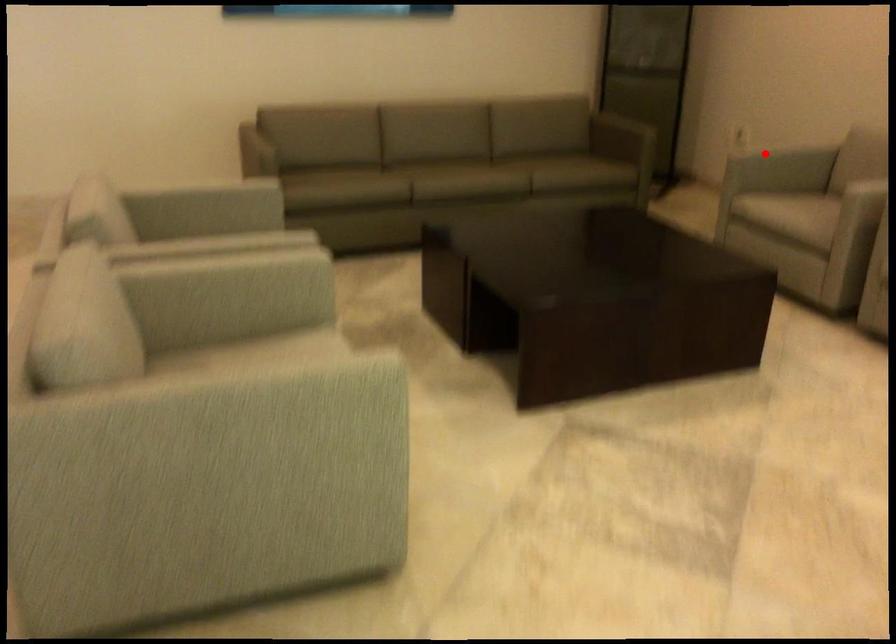
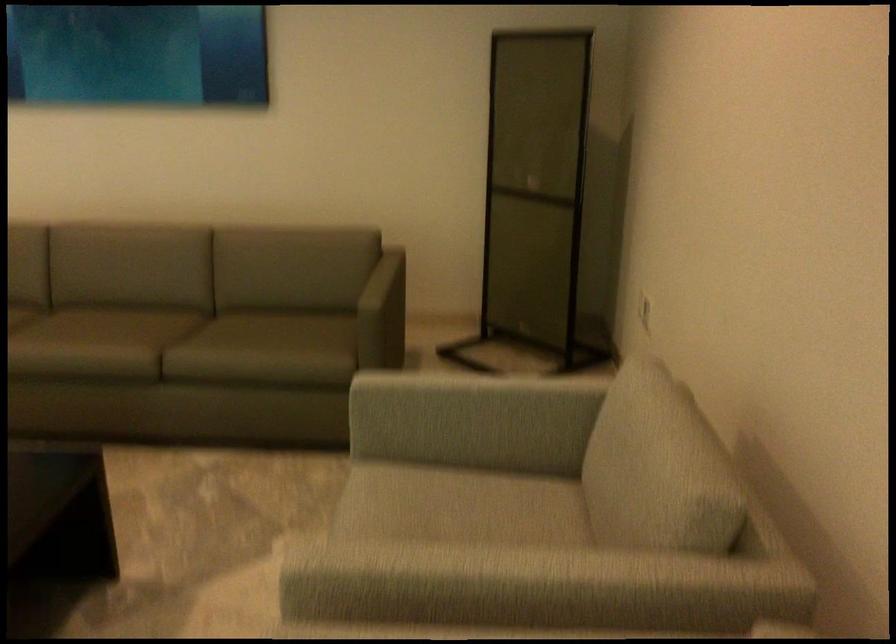
Question: A red point is marked in image1. In image2, is the corresponding 3D point closer to the camera or farther? Reply with the corresponding letter.

Choices:
 (A) The corresponding 3D point is closer.
 (B) The corresponding 3D point is farther.

Answer: (A)